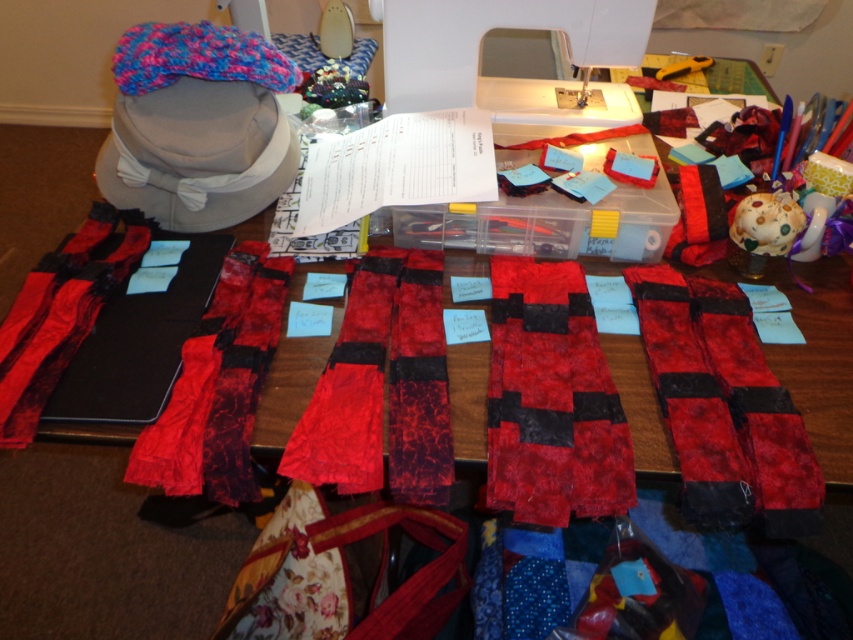
Question: Is textured red fabric at center smaller than white plastic sewing machine at upper center?

Choices:
 (A) yes
 (B) no

Answer: (A)

Question: Does textured red fabric at center have a smaller size compared to knitted wool headband at upper left?

Choices:
 (A) no
 (B) yes

Answer: (B)

Question: In this image, where is textured fabric strips at center located relative to knitted wool headband at upper left?

Choices:
 (A) left
 (B) right

Answer: (A)

Question: Which object appears farthest from the camera in this image?

Choices:
 (A) textured red fabric at center
 (B) textured fabric strips at center
 (C) red velvet scarf at center

Answer: (B)

Question: Which object is the farthest from the red velvet scarf at center?

Choices:
 (A) textured red fabric at center
 (B) textured fabric strips at center
 (C) white plastic sewing machine at upper center

Answer: (B)

Question: Which point is farther to the camera?

Choices:
 (A) (611, 36)
 (B) (165, 472)
 (C) (242, 45)
 (D) (489, 426)

Answer: (A)